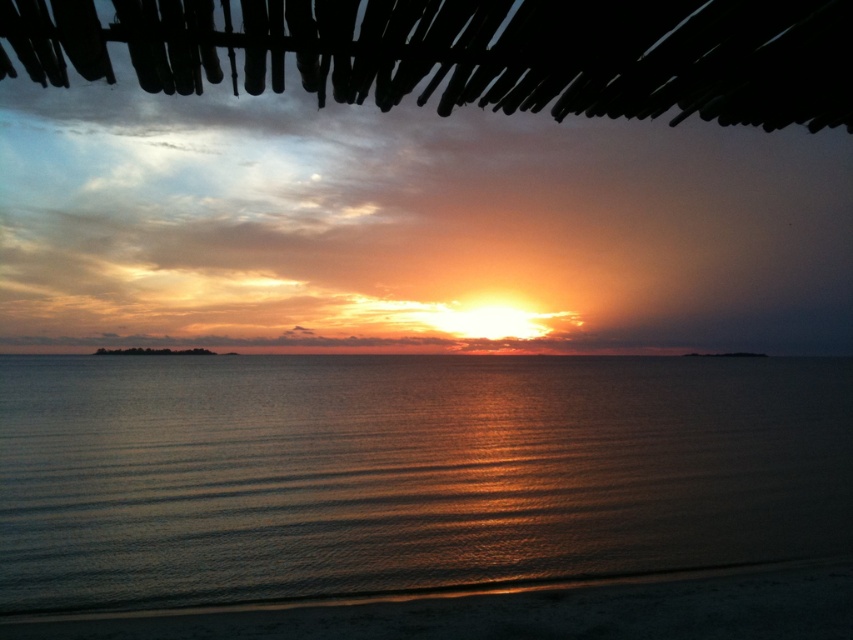
Between shiny metallic water at center and sandy beach at lower center, which one has less height?

sandy beach at lower center

Between point (45, 557) and point (170, 636), which one is positioned in front?

Point (170, 636) is more forward.

Image resolution: width=853 pixels, height=640 pixels. Find the location of `shiny metallic water at center`. shiny metallic water at center is located at coordinates (405, 472).